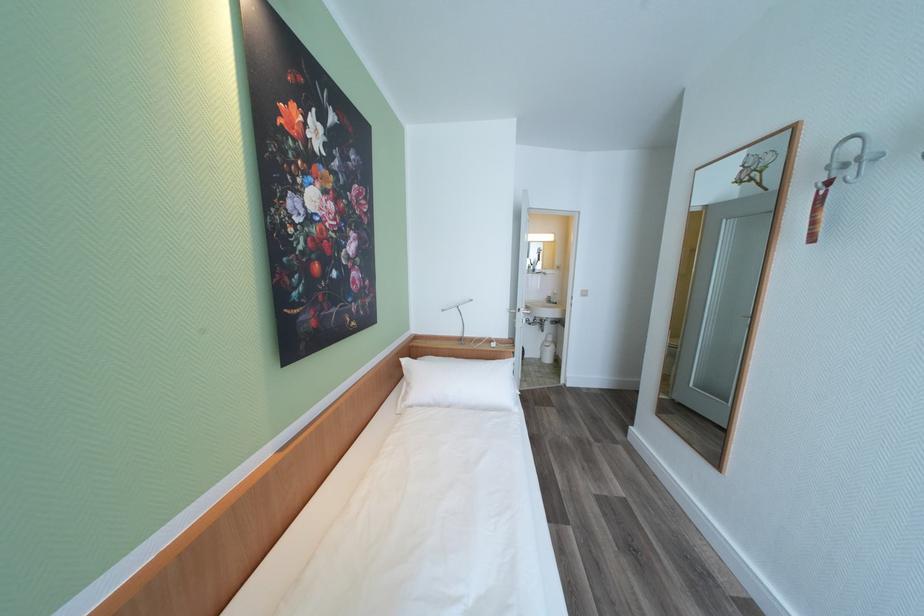
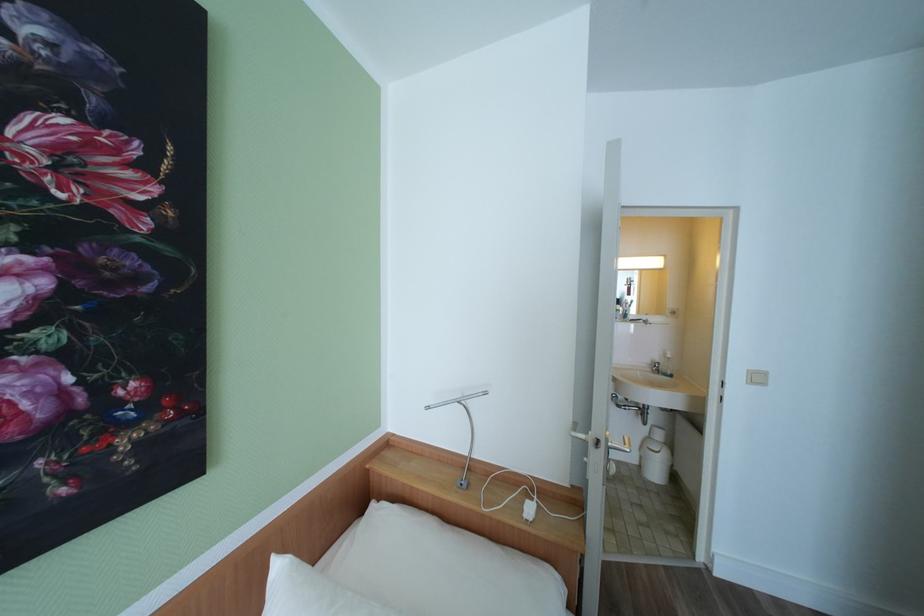
Question: The images are taken continuously from a first-person perspective. In which direction are you moving?

Choices:
 (A) Left
 (B) Right
 (C) Forward
 (D) Backward

Answer: (C)